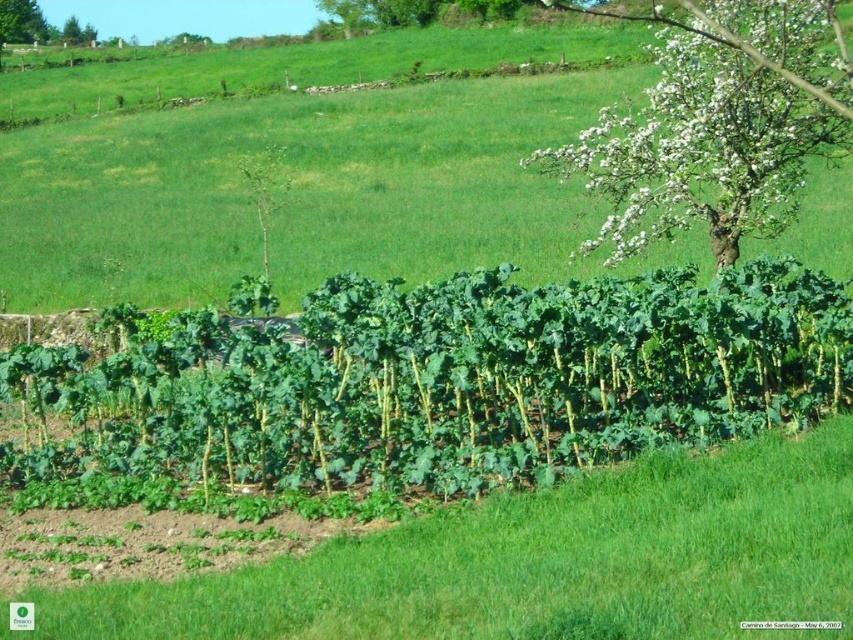
You are standing in the rural landscape and want to walk from the garden bed to the distant grassland. Which point, point (660,272) or point (759,120), is closer to your current position?

Point (660,272) is closer to the camera than point (759,120), so it is closer to your current position.

You are standing at the center of the image. There is a green leafy plant at center in front of you. If you walk straight ahead, will you encounter the garden bed or the open grassland first?

The green leafy plant at center is located at point (430, 385), which is closer to the open grassland than the garden bed. Therefore, walking straight ahead, you would first encounter the open grassland before reaching the garden bed.